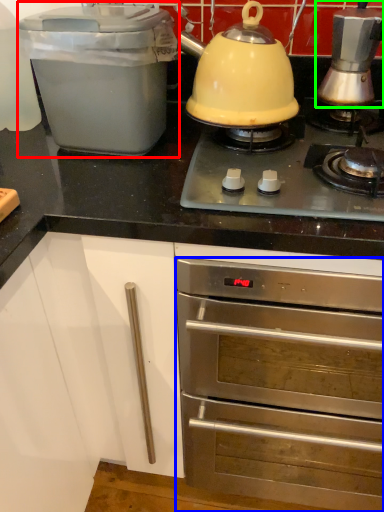
Question: Which object is the closest to the kitchen appliance (highlighted by a red box)? Choose among these: oven (highlighted by a blue box) or kitchen appliance (highlighted by a green box).

Choices:
 (A) oven
 (B) kitchen appliance

Answer: (B)